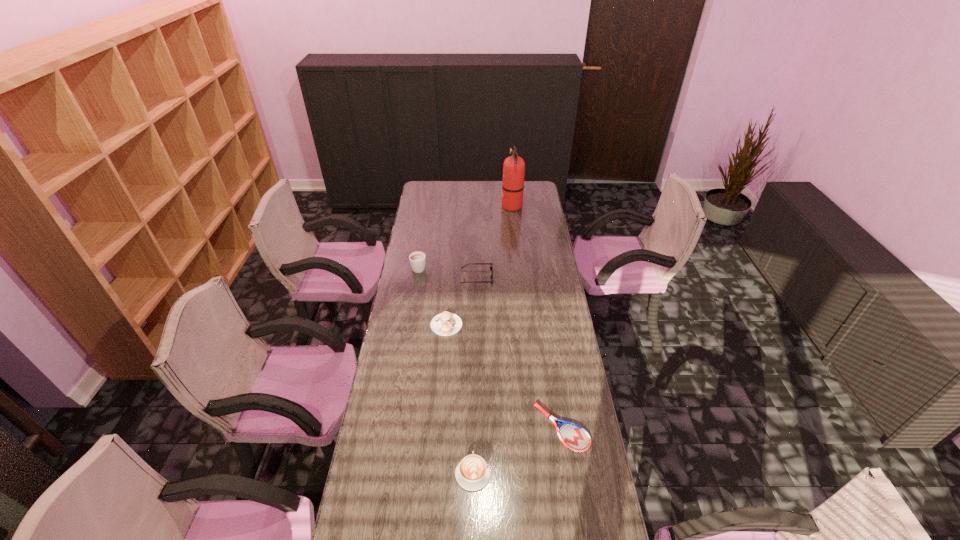
Image resolution: width=960 pixels, height=540 pixels. I want to click on vacant area between the second nearest object and the shortest cappuccino, so click(504, 376).

Image resolution: width=960 pixels, height=540 pixels. Find the location of `empty location between the fifth shortest object and the third shortest object`. empty location between the fifth shortest object and the third shortest object is located at coordinates (446, 370).

Where is `object that is the nearest to the shortest object`? The width and height of the screenshot is (960, 540). object that is the nearest to the shortest object is located at coordinates (472, 473).

Select which object appears as the third closest to the second farthest cappuccino. Please provide its 2D coordinates. Your answer should be formatted as a tuple, i.e. [(x, y)], where the tuple contains the x and y coordinates of a point satisfying the conditions above.

[(573, 436)]

I want to click on cappuccino that is the second closest to the fifth tallest object, so click(472, 473).

I want to click on cappuccino object that ranks as the third closest to the tennis racket, so click(417, 259).